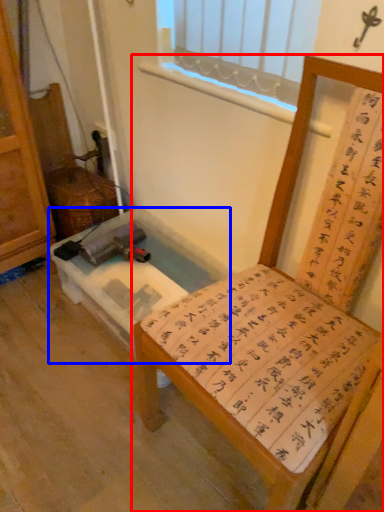
Question: Which object appears farthest to the camera in this image, furniture (highlighted by a red box) or vanity (highlighted by a blue box)?

Choices:
 (A) furniture
 (B) vanity

Answer: (B)